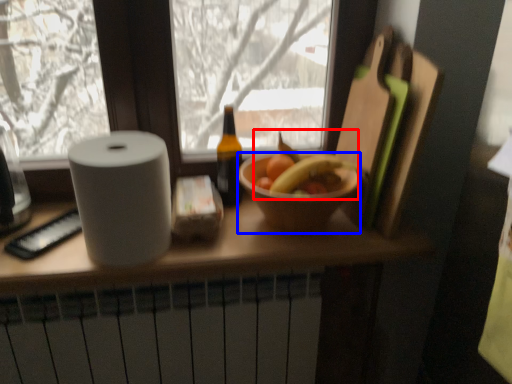
Question: Which point is further to the camera, fruit (highlighted by a red box) or bowl (highlighted by a blue box)?

Choices:
 (A) fruit
 (B) bowl

Answer: (A)